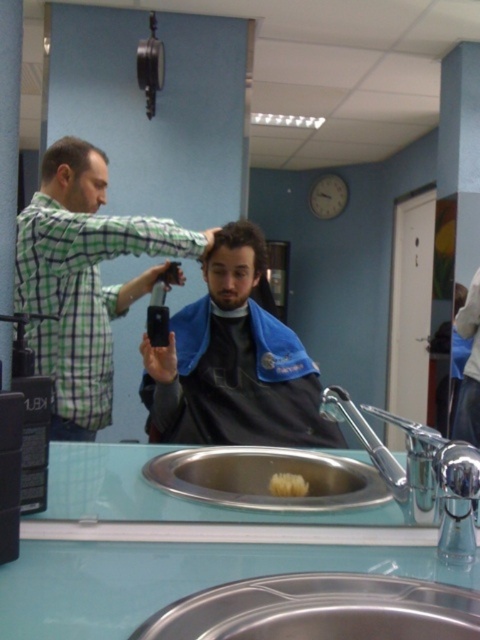
Question: Which of the following is the farthest from the observer?

Choices:
 (A) chrome metallic faucet at sink right
 (B) dark brown hair at center

Answer: (B)

Question: Among these points, which one is nearest to the camera?

Choices:
 (A) (314, 412)
 (B) (249, 224)

Answer: (A)

Question: Observing the image, what is the correct spatial positioning of green checkered shirt at upper left in reference to matte black phone at center?

Choices:
 (A) below
 (B) above

Answer: (B)

Question: Which object is farther from the camera taking this photo?

Choices:
 (A) chrome metallic faucet at sink right
 (B) green checkered shirt at upper left
 (C) dark blue fabric at center

Answer: (C)

Question: Does matte black phone at center appear over dark blue fabric at center?

Choices:
 (A) no
 (B) yes

Answer: (B)

Question: Is green checkered shirt at upper left bigger than dark blue fabric at center?

Choices:
 (A) no
 (B) yes

Answer: (B)